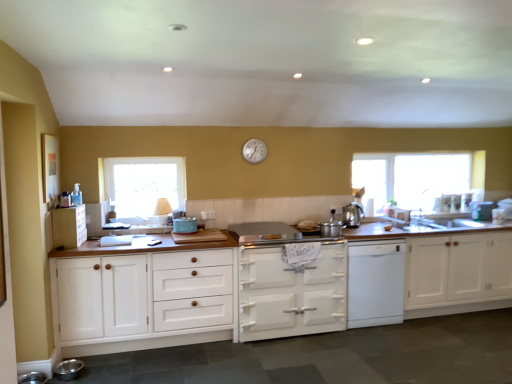
Where is `free spot above clear glass window at left, marked as the 1th window in a front-to-back arrangement (from a real-world perspective)`? Image resolution: width=512 pixels, height=384 pixels. free spot above clear glass window at left, marked as the 1th window in a front-to-back arrangement (from a real-world perspective) is located at coordinates (126, 160).